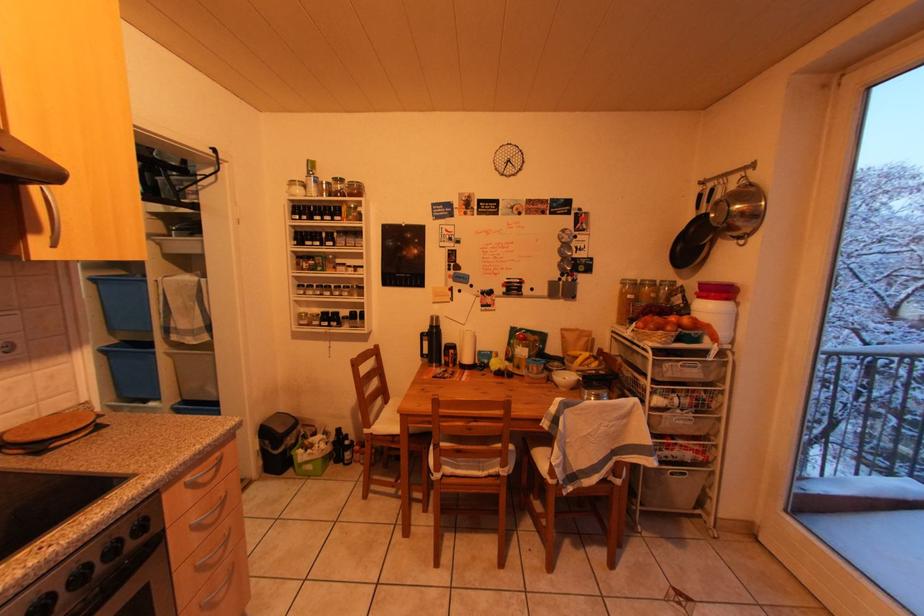
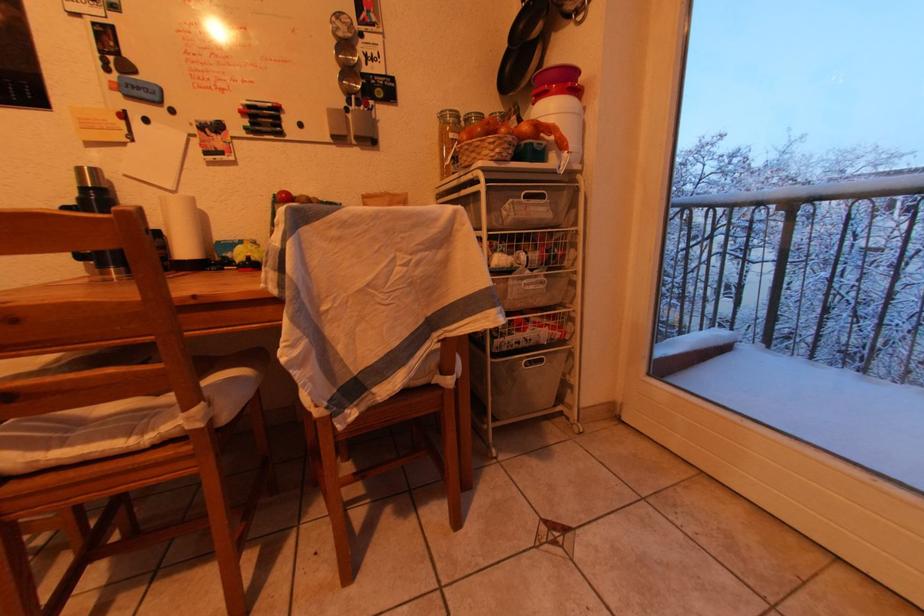
Which direction would the cameraman need to move to produce the second image?

The movement direction of the cameraman is right, forward.